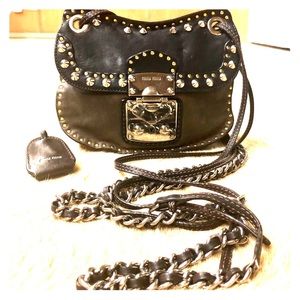
In order to click on floor in this screenshot , I will do `click(32, 84)`.